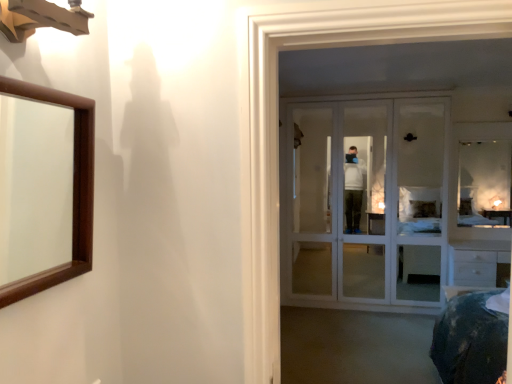
Question: Can you confirm if white glass door at center is smaller than clear glass mirror at upper right, acting as the second mirror starting from the left?

Choices:
 (A) no
 (B) yes

Answer: (A)

Question: Is white glass door at center next to clear glass mirror at upper right, which appears as the first mirror when viewed from the back?

Choices:
 (A) yes
 (B) no

Answer: (B)

Question: Is the position of white glass door at center more distant than that of clear glass mirror at upper right, acting as the second mirror starting from the left?

Choices:
 (A) yes
 (B) no

Answer: (B)

Question: Would you say white glass door at center is outside clear glass mirror at upper right, which appears as the first mirror when viewed from the back?

Choices:
 (A) no
 (B) yes

Answer: (B)

Question: From the image's perspective, would you say white glass door at center is positioned over clear glass mirror at upper right, acting as the second mirror starting from the left?

Choices:
 (A) yes
 (B) no

Answer: (B)

Question: From the image's perspective, is white glass door at center located beneath clear glass mirror at upper right, which appears as the first mirror when viewed from the back?

Choices:
 (A) yes
 (B) no

Answer: (A)

Question: Is white glass door at center bigger than brown wooden mirror at left, which is counted as the first mirror, starting from the left?

Choices:
 (A) no
 (B) yes

Answer: (B)

Question: Is white glass door at center oriented away from brown wooden mirror at left, which is counted as the first mirror, starting from the left?

Choices:
 (A) no
 (B) yes

Answer: (A)

Question: Does white glass door at center have a greater width compared to brown wooden mirror at left, placed as the second mirror when sorted from right to left?

Choices:
 (A) yes
 (B) no

Answer: (A)

Question: From a real-world perspective, is white glass door at center located higher than brown wooden mirror at left, which is counted as the first mirror, starting from the left?

Choices:
 (A) yes
 (B) no

Answer: (B)

Question: From the image's perspective, is white glass door at center below brown wooden mirror at left, which is counted as the first mirror, starting from the left?

Choices:
 (A) no
 (B) yes

Answer: (B)

Question: Is brown wooden mirror at left, placed as the second mirror when sorted from right to left, located within white glass door at center?

Choices:
 (A) yes
 (B) no

Answer: (B)

Question: Is clear glass mirror at upper right, the 2th mirror from the front, taller than white glass door at center?

Choices:
 (A) yes
 (B) no

Answer: (B)